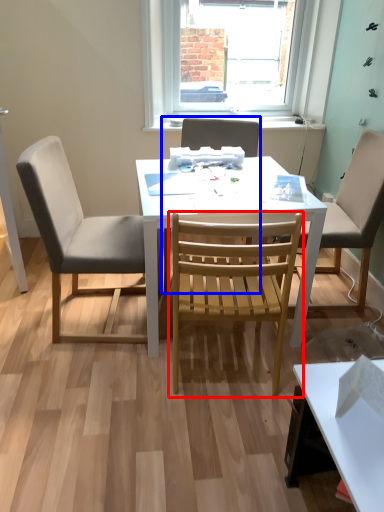
Question: Among these objects, which one is nearest to the camera, chair (highlighted by a red box) or chair (highlighted by a blue box)?

Choices:
 (A) chair
 (B) chair

Answer: (A)